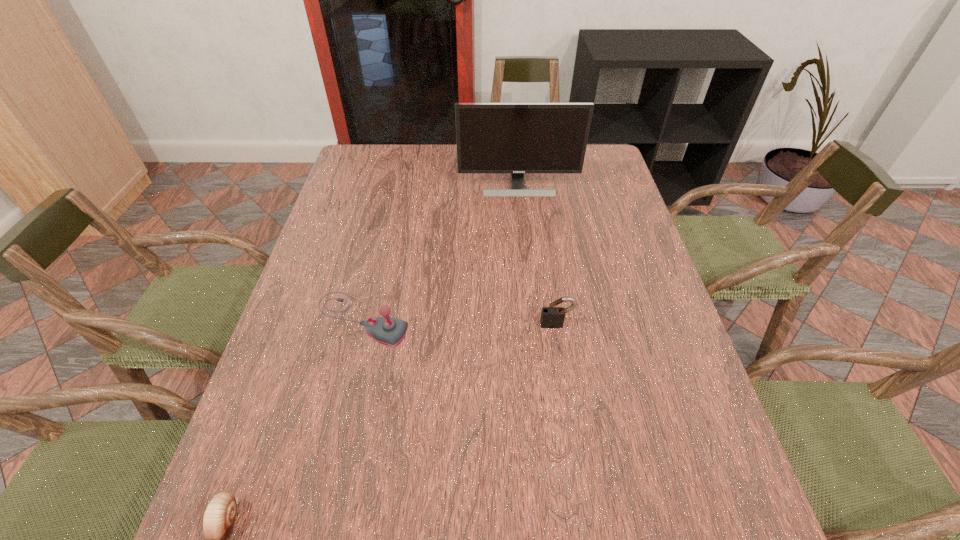
Find the location of a particular element. The height and width of the screenshot is (540, 960). object present at the far right corner is located at coordinates coord(517,138).

Find the location of `vacant space at the far edge of the desktop`. vacant space at the far edge of the desktop is located at coordinates (410, 161).

Where is `free point at the left edge`? free point at the left edge is located at coordinates (363, 281).

Find the location of `vacant space at the right edge of the desktop`. vacant space at the right edge of the desktop is located at coordinates (574, 194).

The width and height of the screenshot is (960, 540). I want to click on free space between the padlock and the joystick, so click(x=459, y=322).

This screenshot has height=540, width=960. What are the coordinates of `free point between the joystick and the farthest object` in the screenshot? It's located at tap(440, 252).

Identify the location of vacant space in between the padlock and the tallest object. The image size is (960, 540). (538, 255).

Where is `vacant space that's between the padlock and the tallest object`? The image size is (960, 540). vacant space that's between the padlock and the tallest object is located at coordinates (538, 255).

The width and height of the screenshot is (960, 540). What are the coordinates of `object that is the second closest one to the tallest object` in the screenshot? It's located at (552, 317).

Select which object is the closest to the escargot. Please provide its 2D coordinates. Your answer should be formatted as a tuple, i.e. [(x, y)], where the tuple contains the x and y coordinates of a point satisfying the conditions above.

[(387, 330)]